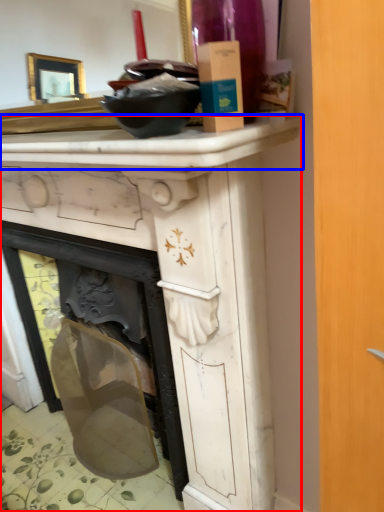
Question: Which object is closer to the camera taking this photo, vanity (highlighted by a red box) or counter top (highlighted by a blue box)?

Choices:
 (A) vanity
 (B) counter top

Answer: (B)